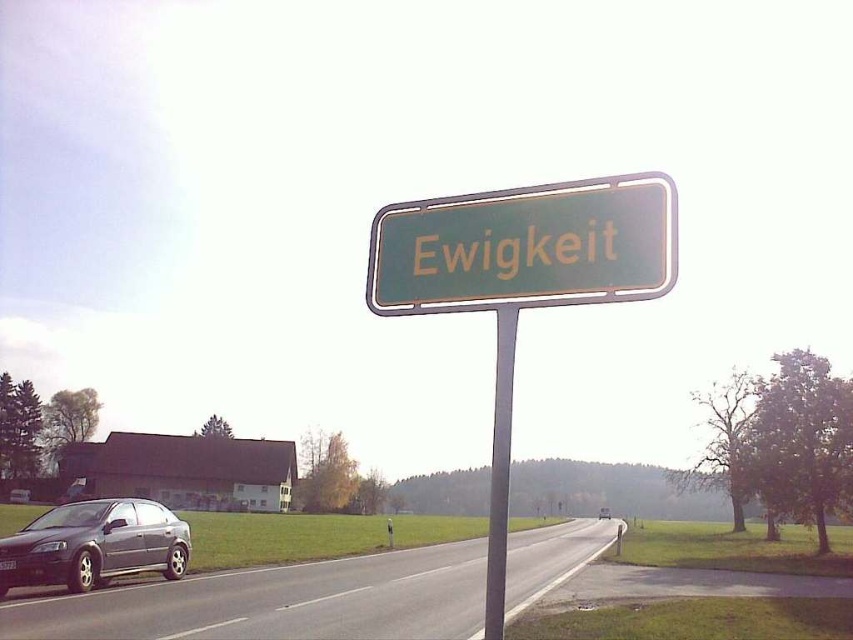
You are a driver approaching the green metallic sign at center and see the metallic gray sedan at lower left on the road. Which object appears wider from your perspective?

The metallic gray sedan at lower left appears wider because it is wider than the green metallic sign at center according to the description.

You are a photographer setting up a tripod to capture the green metallic sign at center and the metallic gray pole at center. If you want to ensure both objects are in frame without moving the tripod, which object will appear wider in the photo?

The green metallic sign at center will appear wider in the photo because its width surpasses that of the metallic gray pole at center.